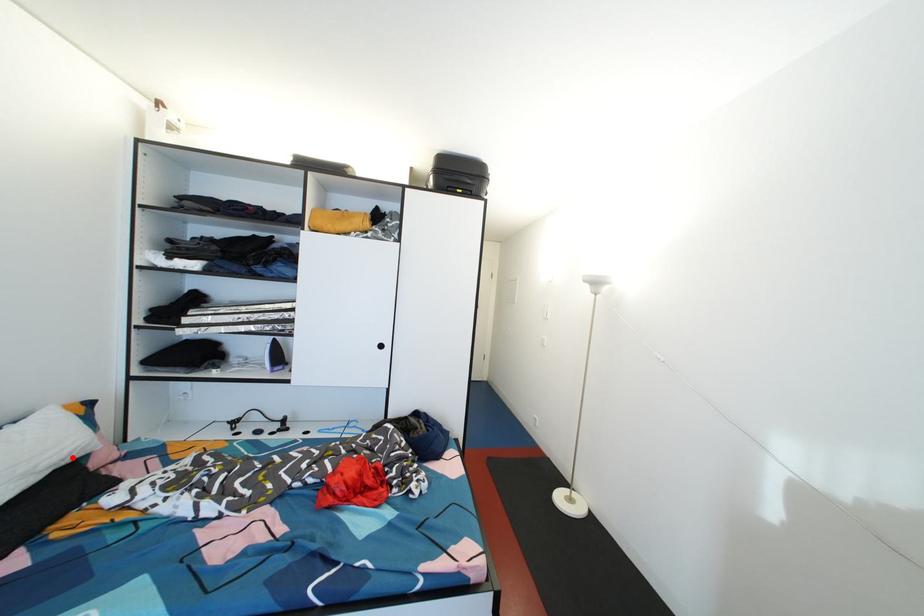
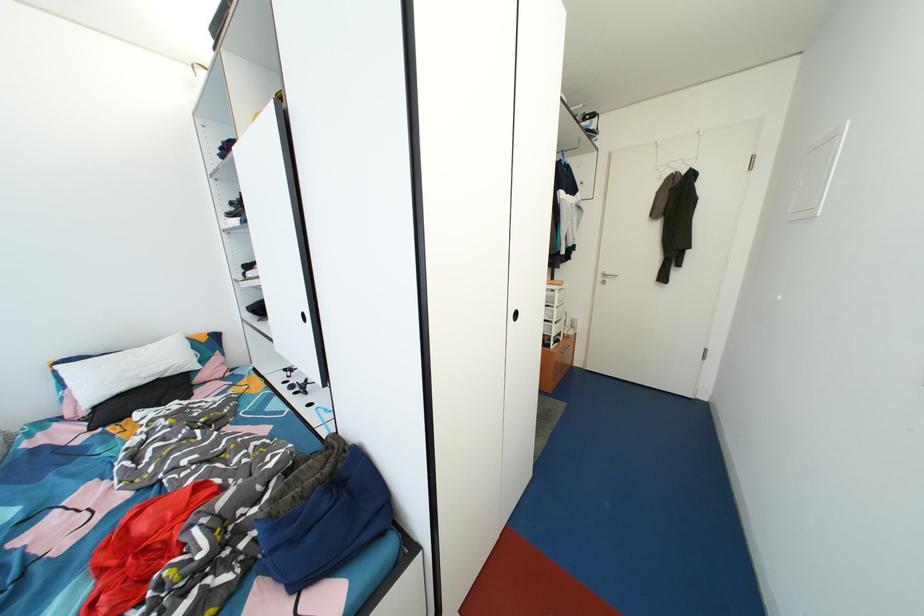
The point at the highlighted location is marked in the first image. Where is the corresponding point in the second image?

(167, 373)